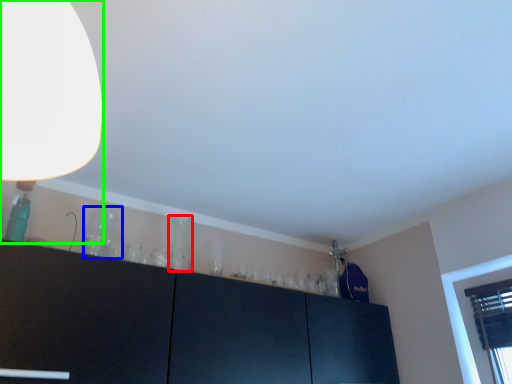
Question: Which object is positioned farthest from glass vase (highlighted by a red box)? Select from glass vase (highlighted by a blue box) and lamp (highlighted by a green box).

Choices:
 (A) glass vase
 (B) lamp

Answer: (B)